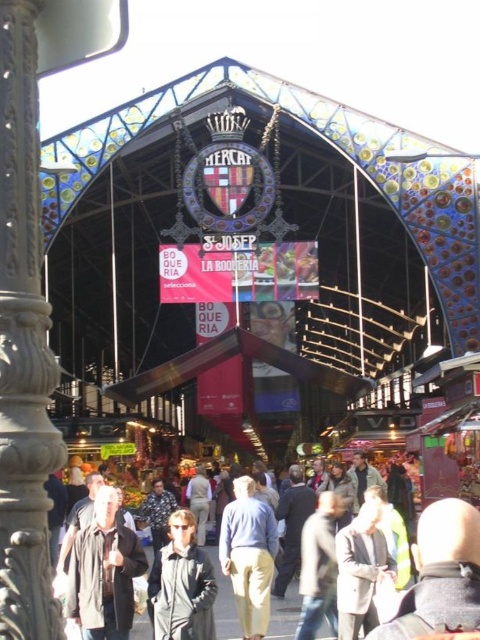
You are standing at the entrance of Mercat de la Boqueria and see two points marked in the image. Which point, point (152, 621) or point (237, 604), is closer to you?

Point (152, 621) is closer to the viewer than point (237, 604).